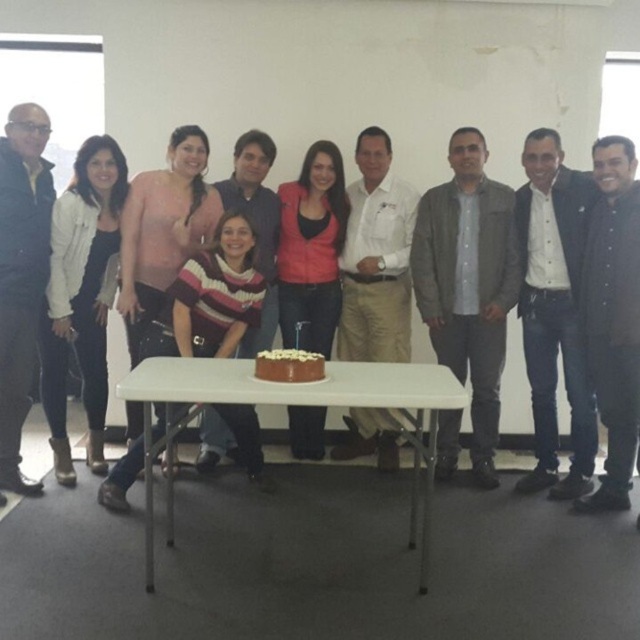
Question: Does light brown leather jacket at center appear under matte white jacket at left?

Choices:
 (A) no
 (B) yes

Answer: (B)

Question: Can you confirm if matte black jacket at left is bigger than chocolate frosted cake at center?

Choices:
 (A) yes
 (B) no

Answer: (A)

Question: Which is farther from the matte white jacket at left?

Choices:
 (A) light brown leather jacket at center
 (B) white plastic table at center
 (C) chocolate frosted cake at center
 (D) matte black jacket at left

Answer: (A)

Question: Does white plastic table at center come in front of chocolate frosted cake at center?

Choices:
 (A) yes
 (B) no

Answer: (A)

Question: Which point is farther from the camera taking this photo?

Choices:
 (A) (420, 381)
 (B) (314, 364)
 (C) (8, 330)
 (D) (534, 362)

Answer: (D)

Question: Which point is closer to the camera?

Choices:
 (A) light brown leather jacket at center
 (B) matte black jacket at left
 (C) white plastic table at center

Answer: (C)